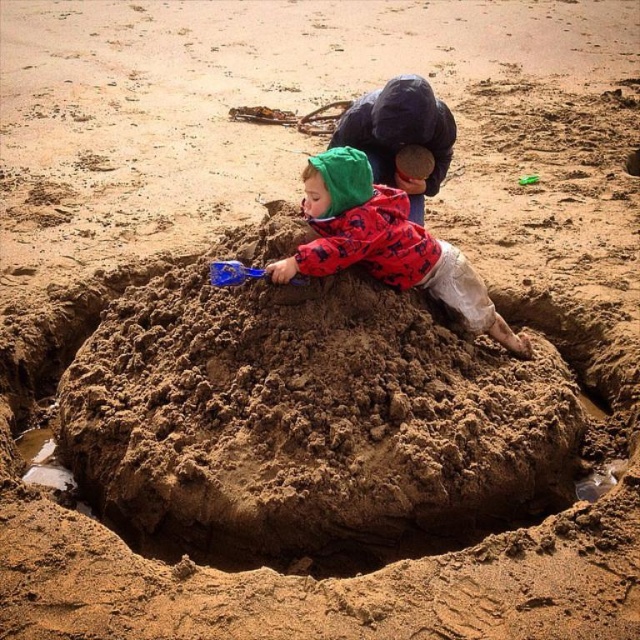
You are standing at the origin point in the image. There are two points marked in the scene. The first point is at coordinate point (x=381, y=244) and the second is at point (x=228, y=264). If you want to reach the point that is further away from you, which coordinate should you go to?

Point (x=381, y=244) is behind point (x=228, y=264), so you should go to point (x=381, y=244) to reach the one further away.

Based on the photo, you are a photographer trying to capture the child in the matte red jacket at center. The camera has a focus point at coordinate point (385,243). Will the focus point successfully capture the matte red jacket at center?

Yes, the focus point at coordinate point (385,243) is exactly where the matte red jacket at center is located, so the focus point will successfully capture the matte red jacket at center.

You are a photographer trying to capture a photo of both the matte red jacket at center and the red plaid shirt at center. Since you want both subjects to be clearly visible in the frame, is there any issue with their current positions?

The matte red jacket at center is in front of the red plaid shirt at center, so the red plaid shirt at center might be partially obscured. To ensure both are clearly visible, adjust their positions so they are side by side or the red plaid shirt at center is moved forward.